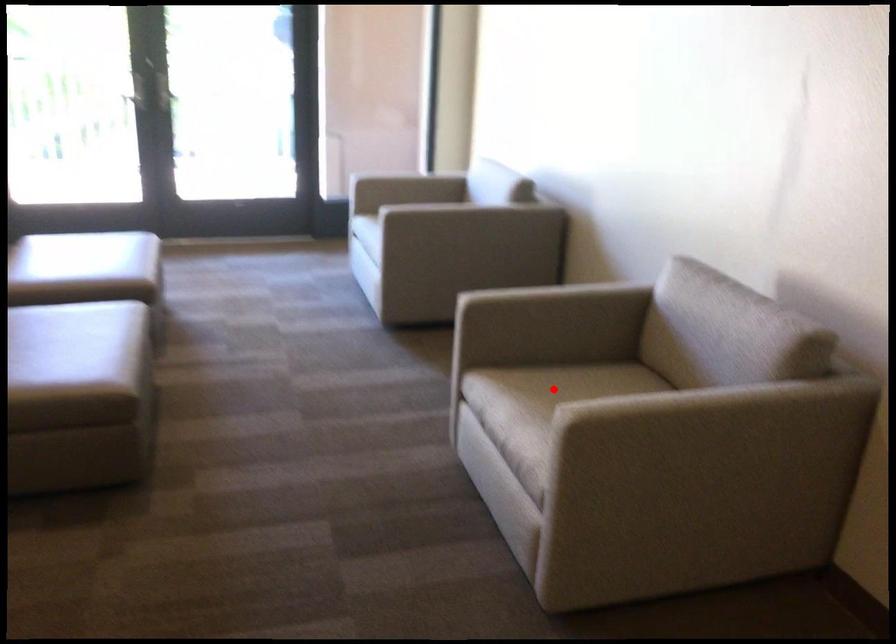
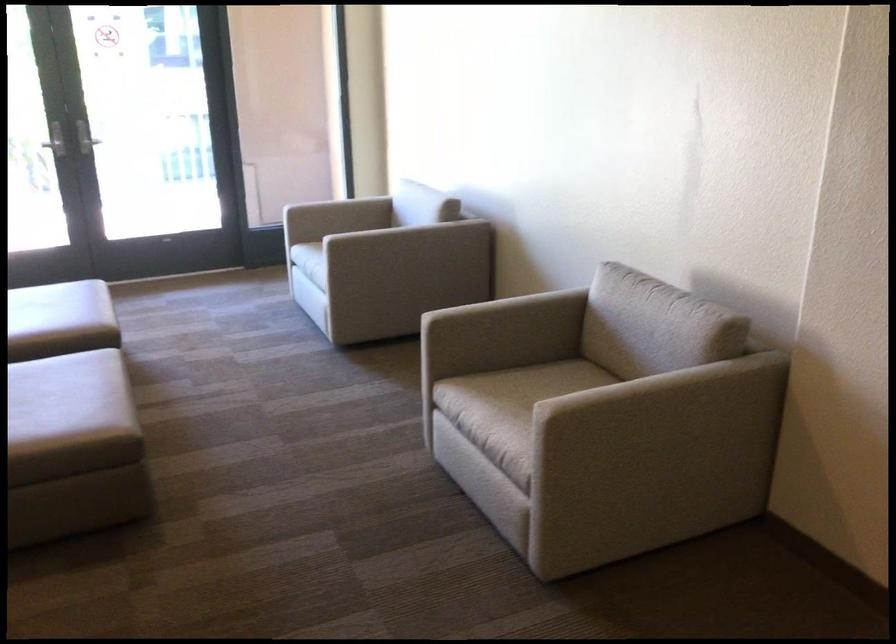
Locate, in the second image, the point that corresponds to the highlighted location in the first image.

(513, 389)